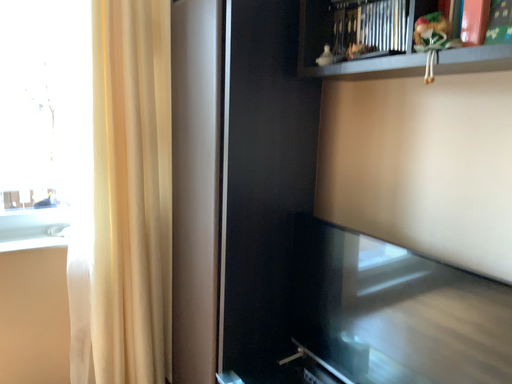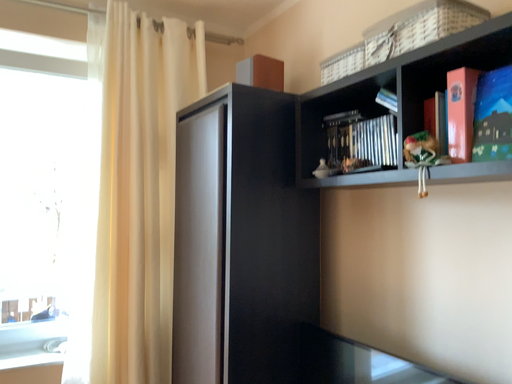
Question: How did the camera likely rotate when shooting the video?

Choices:
 (A) rotated downward
 (B) rotated upward

Answer: (B)